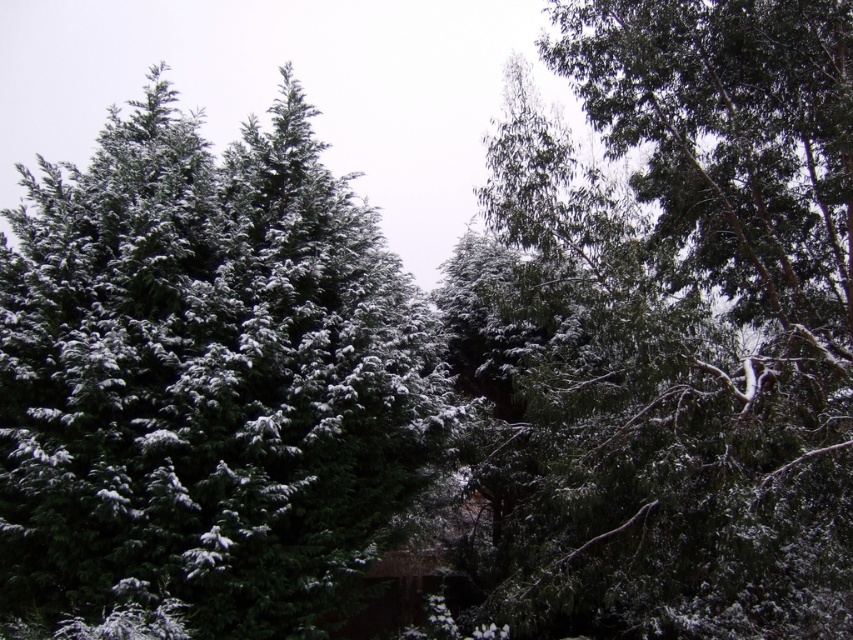
Question: Is green matte tree at upper center positioned at the back of green matte tree at upper left?

Choices:
 (A) yes
 (B) no

Answer: (B)

Question: In this image, where is green matte tree at upper center located relative to green matte tree at upper left?

Choices:
 (A) above
 (B) below

Answer: (A)

Question: Which point is closer to the camera?

Choices:
 (A) (32, 540)
 (B) (578, 252)

Answer: (A)

Question: Which object is closer to the camera taking this photo?

Choices:
 (A) green matte tree at upper center
 (B) green matte tree at upper left

Answer: (A)

Question: Observing the image, what is the correct spatial positioning of green matte tree at upper center in reference to green matte tree at upper left?

Choices:
 (A) left
 (B) right

Answer: (B)

Question: Which point is farther from the camera taking this photo?

Choices:
 (A) (192, 321)
 (B) (770, 276)

Answer: (B)